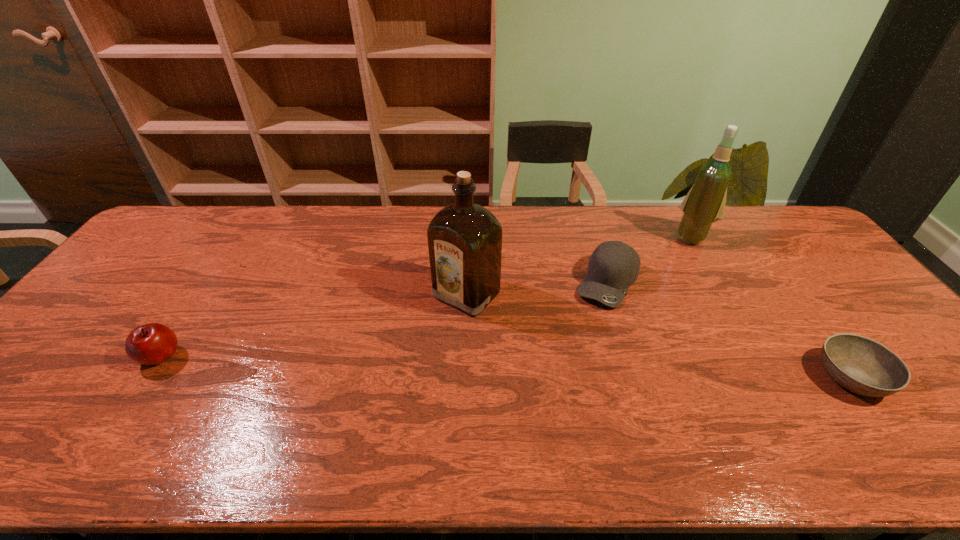
I want to click on free space on the desktop that is between the apple and the shortest object and is positioned on the front brim of the third object from right to left, so click(567, 368).

Find the location of a particular element. The image size is (960, 540). vacant spot on the desktop that is between the leftmost object and the rightmost object and is positioned on the front-facing side of the farthest object is located at coordinates (601, 369).

Find the location of a particular element. The width and height of the screenshot is (960, 540). free space on the desktop that is between the leftmost object and the bowl and is positioned on the label of the fourth object from right to left is located at coordinates (397, 363).